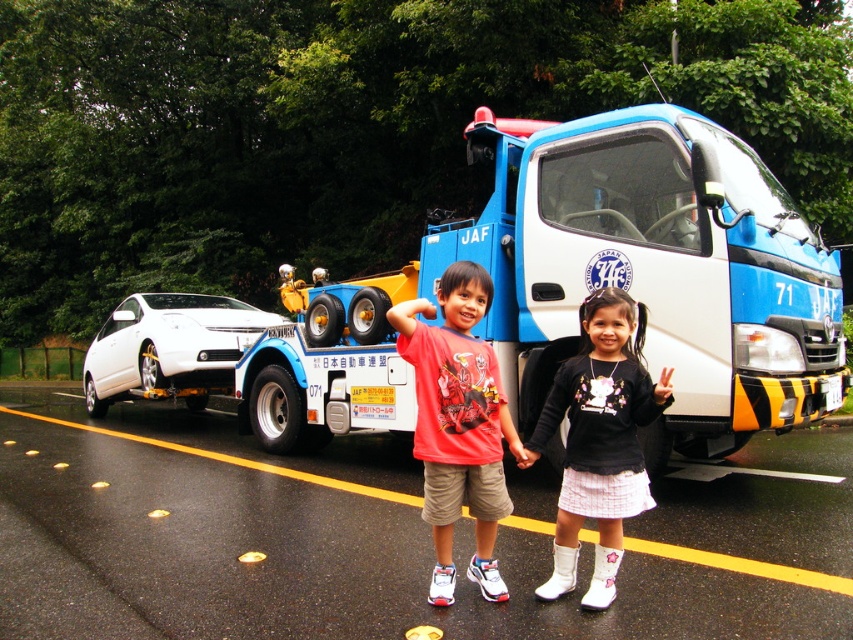
Based on the photo, can you confirm if black matte sweater at center is thinner than white glossy car at left?

Yes, black matte sweater at center is thinner than white glossy car at left.

Can you confirm if black matte sweater at center is positioned above white glossy car at left?

Incorrect, black matte sweater at center is not positioned above white glossy car at left.

Does point (602, 451) come in front of point (96, 371)?

Yes.

Locate an element on the screen. black matte sweater at center is located at coordinates (599, 440).

Does matte red shirt at center appear under white glossy car at left?

Yes, matte red shirt at center is below white glossy car at left.

Between point (555, 580) and point (251, 310), which one is positioned behind?

The point (251, 310) is more distant.

At what (x,y) coordinates should I click in order to perform the action: click on matte red shirt at center. Please return your answer as a coordinate pair (x, y). The height and width of the screenshot is (640, 853). Looking at the image, I should click on (599, 440).

Can you confirm if blue metallic tow truck at center is wider than white glossy car at left?

No, blue metallic tow truck at center is not wider than white glossy car at left.

Is blue metallic tow truck at center closer to camera compared to white glossy car at left?

→ That is True.

Does point (763, 310) lie behind point (164, 337)?

No, (763, 310) is in front of (164, 337).

This screenshot has width=853, height=640. I want to click on blue metallic tow truck at center, so click(x=585, y=289).